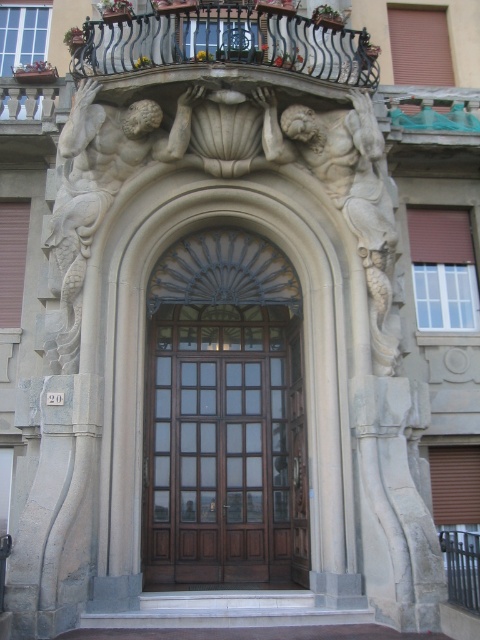
Looking at this image, you are an art student standing in front of the entrance and want to sketch both the mahogany wood door at center and the carved stone figures at center. Which object should you focus on first to capture their relative positions accurately?

You should focus on the mahogany wood door at center first because it is closer to you than the carved stone figures at center, so it will appear larger and more prominent in your sketch.

Consider the image. You are an architect designing a new building entrance. You want to place a decorative metal grille above the mahogany wood door at center. Where should you position it?

The decorative metal grille should be positioned above the mahogany wood door at center, which is located at point (226, 448).